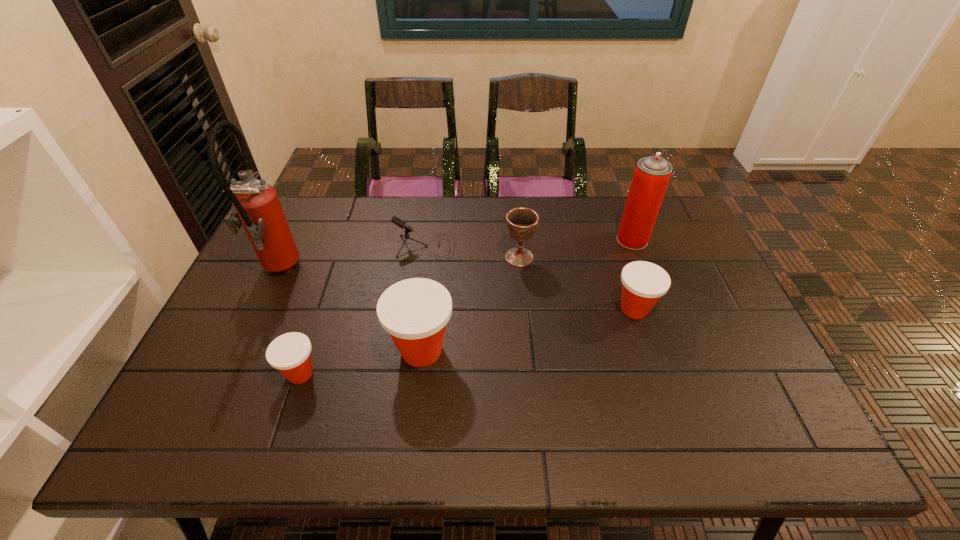
You are a GUI agent. You are given a task and a screenshot of the screen. Output one action in this format:
    pyautogui.click(x=<x>, y=<y>)
    Task: Click on the sixth object from right to left
    
    Given the screenshot: What is the action you would take?
    pyautogui.click(x=290, y=353)

You are a GUI agent. You are given a task and a screenshot of the screen. Output one action in this format:
    pyautogui.click(x=<x>, y=<y>)
    Task: Click on the leftmost Dixie cup
    The height and width of the screenshot is (540, 960).
    Given the screenshot: What is the action you would take?
    pyautogui.click(x=290, y=353)

The height and width of the screenshot is (540, 960). In order to click on the tallest Dixie cup in this screenshot , I will do `click(415, 311)`.

The height and width of the screenshot is (540, 960). What are the coordinates of `the second tallest Dixie cup` in the screenshot? It's located at (643, 283).

Identify the location of microphone. The width and height of the screenshot is (960, 540). (402, 224).

Image resolution: width=960 pixels, height=540 pixels. What are the coordinates of `the tallest object` in the screenshot? It's located at (256, 206).

Find the location of a particular element. This screenshot has height=540, width=960. the leftmost object is located at coordinates 256,206.

Identify the location of chalice. This screenshot has width=960, height=540. (522, 223).

This screenshot has height=540, width=960. What are the coordinates of `the sixth shortest object` in the screenshot? It's located at (652, 174).

Where is `blank space located 0.220m on the back of the shortest object`? This screenshot has width=960, height=540. blank space located 0.220m on the back of the shortest object is located at coordinates (327, 293).